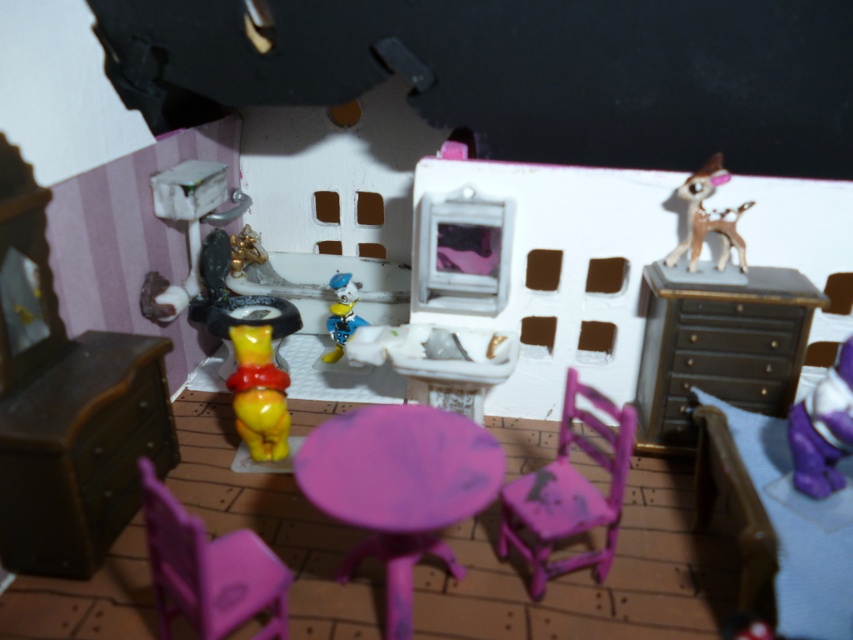
You are a small toy mouse exploring the miniature room. You want to climb onto the matte brown dresser at upper right but are currently on the matte pink plastic chair at lower left. Can you reach the dresser from your current position?

The matte brown dresser at upper right is positioned over the matte pink plastic chair at lower left, so yes, the mouse can climb onto the dresser from the chair since it is directly above it.

Based on the photo, you are standing in the miniature room and want to place a small decoration. You have two points marked in the scene, point (57,541) and point (341,321). Which point is closer to you where you can place the decoration?

Point (57,541) is closer to the viewer than point (341,321), so you can place the decoration there.

In the scene shown: In the miniature room scene, there is a matte brown dresser at upper right and a yellow matte winnie the pooh at center. Which object takes up more space in the scene?

The matte brown dresser at upper right is bigger than the yellow matte winnie the pooh at center, so it takes up more space in the scene.